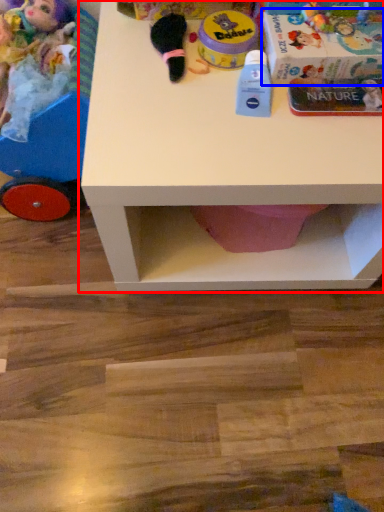
Question: Which point is further to the camera, table (highlighted by a red box) or box (highlighted by a blue box)?

Choices:
 (A) table
 (B) box

Answer: (B)